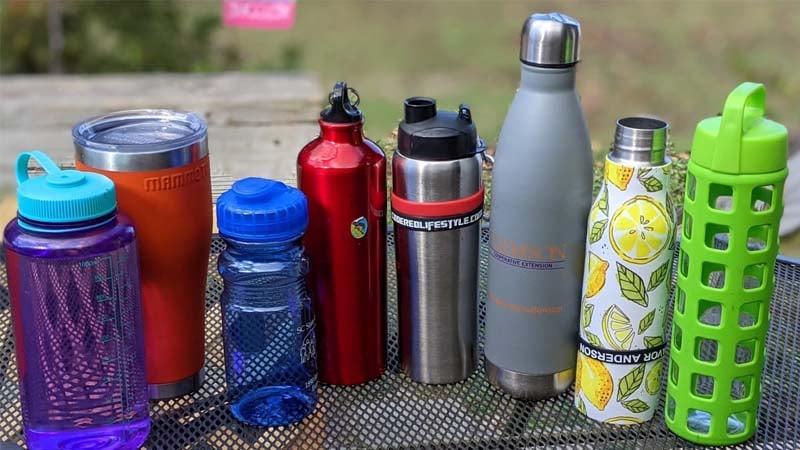
I want to click on bottles with plastic caps, so point(66,194), point(262,218), point(429,144), point(742,152).